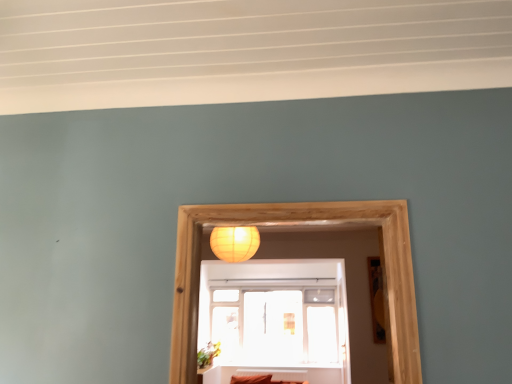
Question: Does wooden picture frame at right appear on the right side of transparent glass window at center?

Choices:
 (A) yes
 (B) no

Answer: (A)

Question: Is wooden picture frame at right looking in the opposite direction of transparent glass window at center?

Choices:
 (A) yes
 (B) no

Answer: (B)

Question: Does wooden picture frame at right have a lesser height compared to transparent glass window at center?

Choices:
 (A) yes
 (B) no

Answer: (A)

Question: Is wooden picture frame at right taller than transparent glass window at center?

Choices:
 (A) yes
 (B) no

Answer: (B)

Question: Are wooden picture frame at right and transparent glass window at center making contact?

Choices:
 (A) no
 (B) yes

Answer: (A)

Question: In the image, is wooden picture frame at right on the left side or the right side of matte yellow paper lantern at upper center?

Choices:
 (A) right
 (B) left

Answer: (A)

Question: From the image's perspective, is wooden picture frame at right above or below matte yellow paper lantern at upper center?

Choices:
 (A) below
 (B) above

Answer: (A)

Question: Considering the positions of point (376, 316) and point (248, 251), is point (376, 316) closer or farther from the camera than point (248, 251)?

Choices:
 (A) closer
 (B) farther

Answer: (A)

Question: Is wooden picture frame at right bigger or smaller than matte yellow paper lantern at upper center?

Choices:
 (A) small
 (B) big

Answer: (A)

Question: From a real-world perspective, is transparent glass window at center positioned above or below wooden picture frame at right?

Choices:
 (A) above
 (B) below

Answer: (B)

Question: Considering their positions, is transparent glass window at center located in front of or behind wooden picture frame at right?

Choices:
 (A) behind
 (B) front

Answer: (A)

Question: Is point (249, 352) closer or farther from the camera than point (373, 278)?

Choices:
 (A) closer
 (B) farther

Answer: (B)

Question: Which is correct: transparent glass window at center is inside wooden picture frame at right, or outside of it?

Choices:
 (A) inside
 (B) outside

Answer: (B)

Question: From the image's perspective, relative to matte yellow paper lantern at upper center, is transparent glass window at center above or below?

Choices:
 (A) below
 (B) above

Answer: (A)

Question: Is transparent glass window at center in front of or behind matte yellow paper lantern at upper center in the image?

Choices:
 (A) front
 (B) behind

Answer: (B)